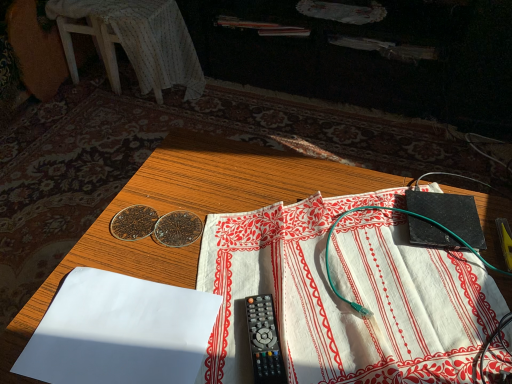
This screenshot has height=384, width=512. I want to click on vacant point above wooden table at center (from a real-world perspective), so click(x=305, y=269).